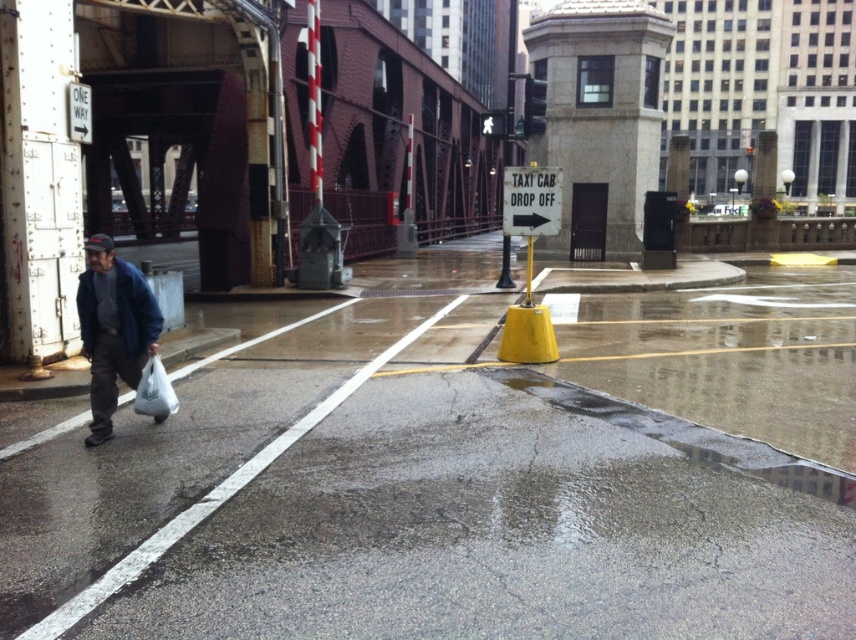
Does concrete wet pavement at lower left have a lesser height compared to white plastic bag at lower left?

Incorrect, concrete wet pavement at lower left's height does not fall short of white plastic bag at lower left's.

Locate an element on the screen. The height and width of the screenshot is (640, 856). concrete wet pavement at lower left is located at coordinates (458, 470).

Which of these two, blue denim jacket at left or white plastic bag at lower left, stands taller?

blue denim jacket at left

Consider the image. Is blue denim jacket at left shorter than white plastic bag at lower left?

No.

Is point (110, 268) in front of point (163, 374)?

That is True.

You are a GUI agent. You are given a task and a screenshot of the screen. Output one action in this format:
    pyautogui.click(x=<x>, y=<y>)
    Task: Click on the blue denim jacket at left
    The image size is (856, 640).
    Given the screenshot: What is the action you would take?
    pos(113,328)

Can you confirm if concrete wet pavement at lower left is smaller than blue denim jacket at left?

Incorrect, concrete wet pavement at lower left is not smaller in size than blue denim jacket at left.

Does concrete wet pavement at lower left appear on the left side of blue denim jacket at left?

In fact, concrete wet pavement at lower left is to the right of blue denim jacket at left.

Between point (251, 392) and point (113, 316), which one is positioned behind?

The point (251, 392) is more distant.

Where is `concrete wet pavement at lower left`? concrete wet pavement at lower left is located at coordinates (458, 470).